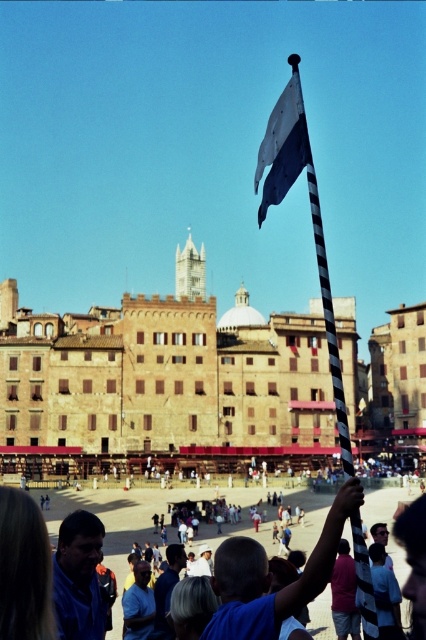
Does brown stone building at center have a lesser height compared to white fabric flag at upper center?

Indeed, brown stone building at center has a lesser height compared to white fabric flag at upper center.

Between brown stone building at center and white fabric flag at upper center, which one is positioned lower?

Positioned lower is brown stone building at center.

Is point (175, 381) behind point (275, 198)?

Yes, it is behind point (275, 198).

At what (x,y) coordinates should I click in order to perform the action: click on brown stone building at center. Please return your answer as a coordinate pair (x, y). The image size is (426, 640). Looking at the image, I should click on (163, 381).